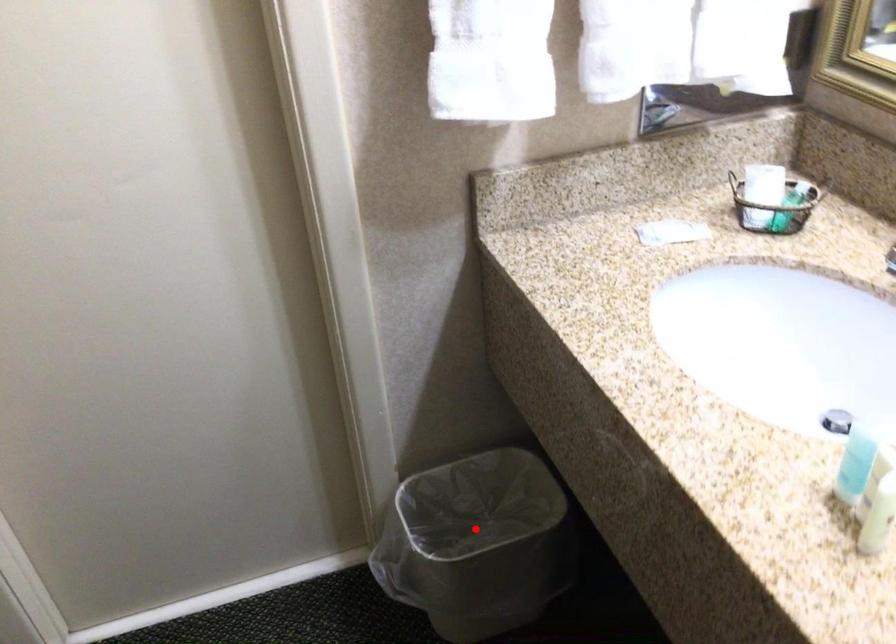
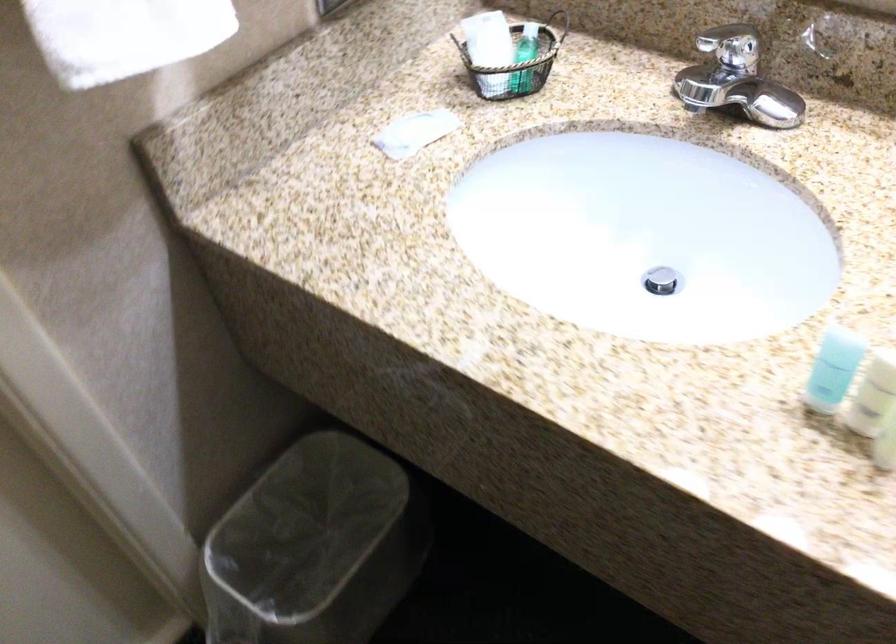
Question: I am providing you with two images of the same scene from different viewpoints. In image1, a red point is highlighted. Considering the same 3D point in image2, which of the following is correct?

Choices:
 (A) It is closer
 (B) It is farther

Answer: (A)